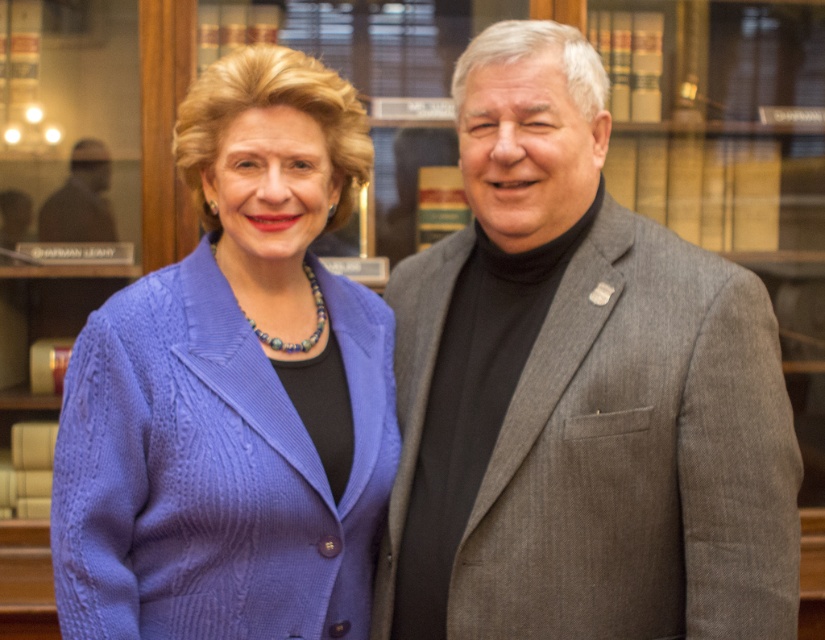
You are standing in the formal setting described in the scene. You need to place a small decorative item exactly halfway between the point at coordinates point (597, 634) and the point at coordinates point (114, 397). Will this item be closer to the person on the left or the person on the right?

The point halfway between point (597, 634) and point (114, 397) will be closer to the person on the right because point (597, 634) is in front of point (114, 397).

Based on the photo, you are standing in a room where two people are positioned as described. You need to place a small decoration exactly at point (550, 22). If the decoration requires a surface that is at least 5 feet away from the camera to avoid being too prominent, will this point work?

The distance of point (550, 22) from camera is 5.43 feet, which is more than 5 feet. Therefore, placing the decoration at point (550, 22) meets the requirement as it is sufficiently distant.